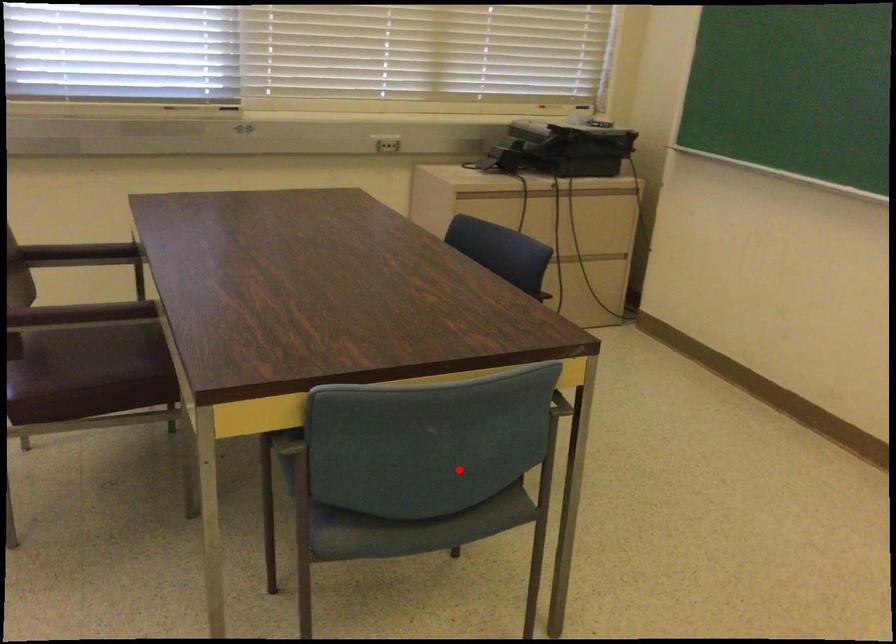
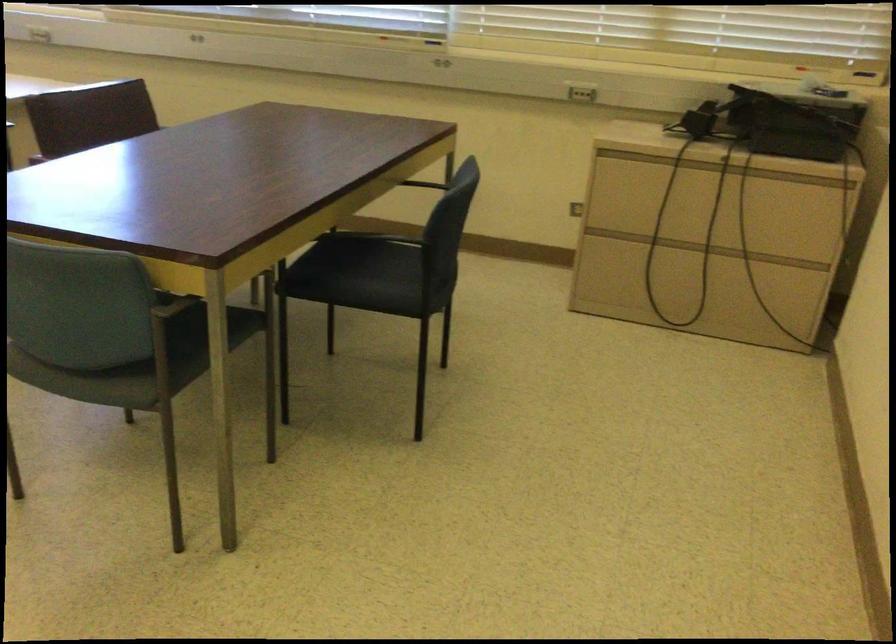
The point at the highlighted location is marked in the first image. Where is the corresponding point in the second image?

(173, 359)